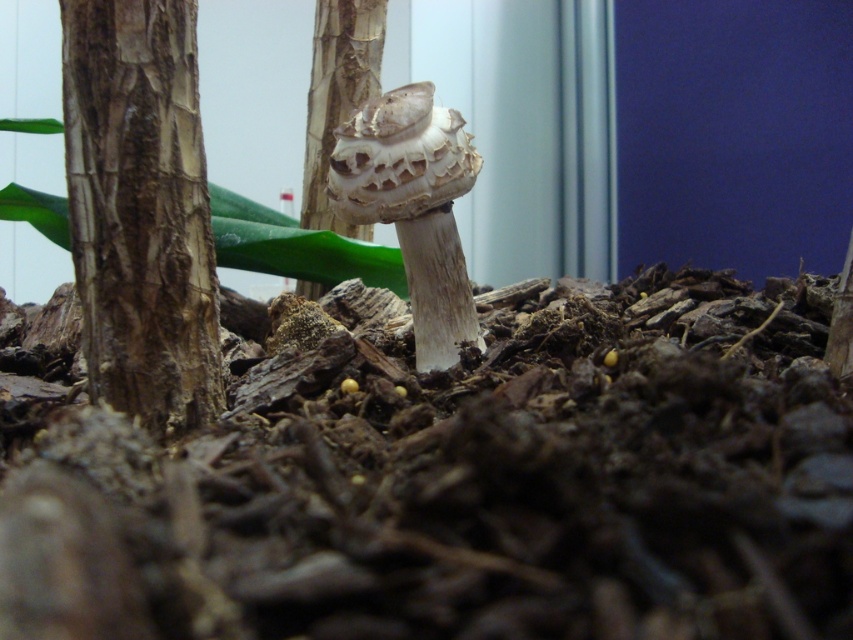
Which is above, brown textured bark at left or smooth bark tree trunk at center?

smooth bark tree trunk at center is above.

Who is more distant from viewer, (204, 164) or (296, 285)?

Positioned behind is point (296, 285).

What do you see at coordinates (140, 209) in the screenshot? This screenshot has height=640, width=853. I see `brown textured bark at left` at bounding box center [140, 209].

Where is `brown textured bark at left`? This screenshot has width=853, height=640. brown textured bark at left is located at coordinates (140, 209).